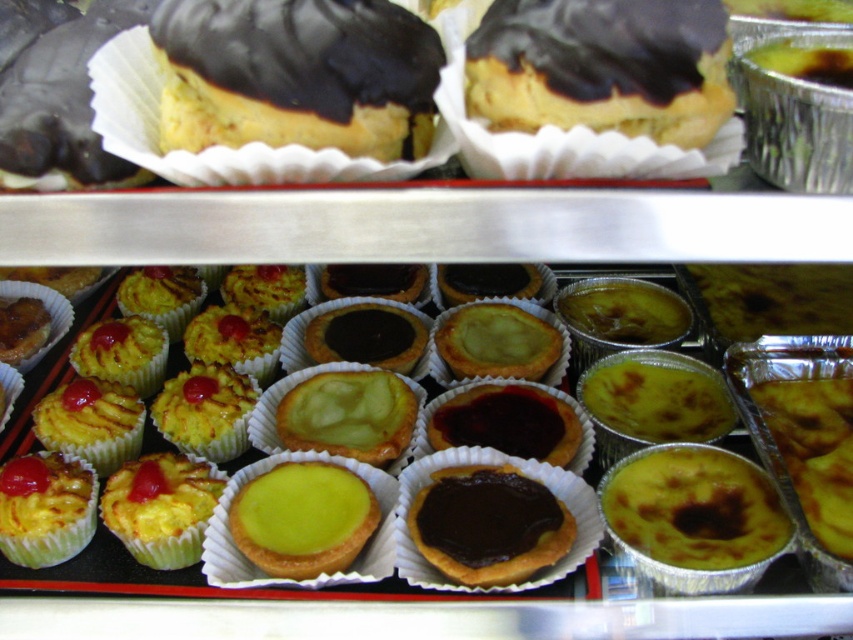
You are a GUI agent. You are given a task and a screenshot of the screen. Output one action in this format:
    pyautogui.click(x=<x>, y=<y>)
    Task: Click on the chocolate-coated pastry at upper left
    The width and height of the screenshot is (853, 640).
    Given the screenshot: What is the action you would take?
    pyautogui.click(x=57, y=96)

Is point (30, 150) closer to viewer compared to point (492, 560)?

Yes, it is.

Between point (51, 154) and point (503, 525), which one is positioned in front?

Point (51, 154) is in front.

What are the coordinates of `chocolate-coated pastry at upper left` in the screenshot? It's located at (57, 96).

Between chocolate-coated pastry at upper left and lime green custard tartlet at center, which one is positioned higher?

Positioned higher is chocolate-coated pastry at upper left.

Is point (55, 88) closer to camera compared to point (331, 556)?

Yes.

Image resolution: width=853 pixels, height=640 pixels. In order to click on chocolate-coated pastry at upper left in this screenshot , I will do `click(57, 96)`.

Does yellow matte cupcake at lower left appear over green matte tartlet at center?

Incorrect, yellow matte cupcake at lower left is not positioned above green matte tartlet at center.

Between yellow matte cupcake at lower left and green matte tartlet at center, which one appears on the left side from the viewer's perspective?

Positioned to the left is yellow matte cupcake at lower left.

Where is `yellow matte cupcake at lower left`? yellow matte cupcake at lower left is located at coordinates (161, 508).

Locate an element on the screen. The width and height of the screenshot is (853, 640). yellow matte cupcake at lower left is located at coordinates click(161, 508).